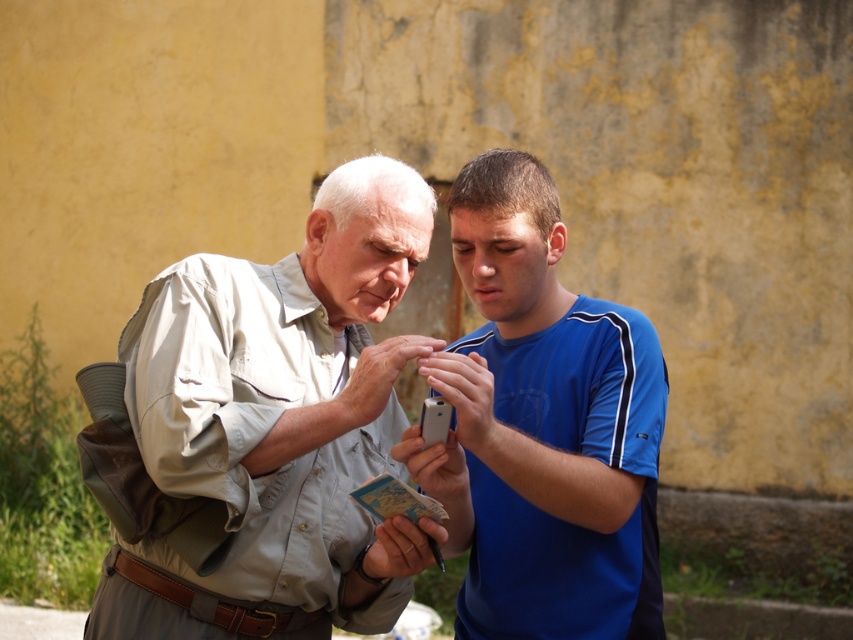
You are a tailor measuring shirts for a customer. You need to determine if both the light beige shirt at center and the blue smooth shirt at center can fit on a 15 inch wide tailor stand. Can they both fit side by side?

The distance between the light beige shirt at center and the blue smooth shirt at center is 15.10 inches. Since the tailor stand is only 15 inches wide, the shirts would not fit side by side as the combined width exceeds the available space by 0.10 inches.

Based on the scene described, what object is located at the coordinates point (277,424)?

The light beige shirt at center is located at point (277,424).